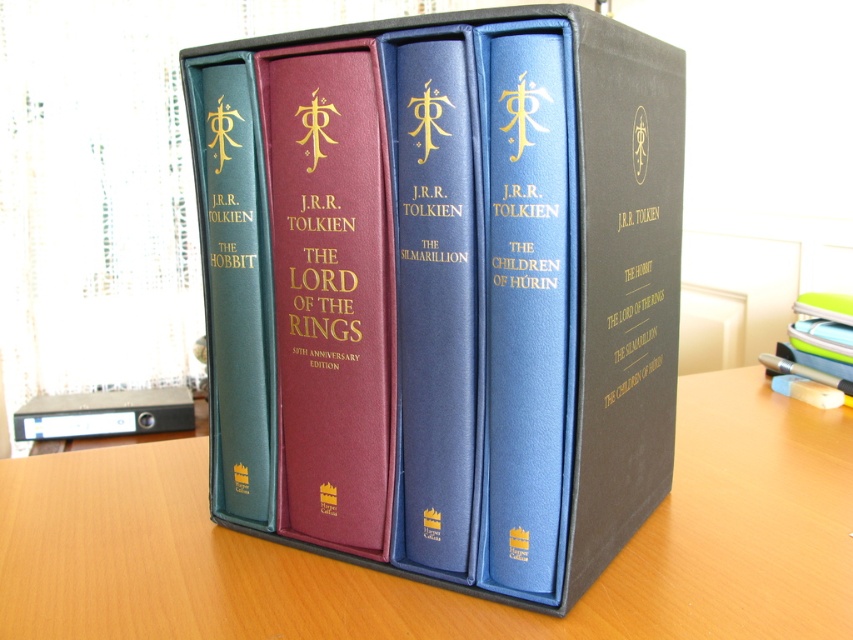
Who is positioned more to the right, wooden table at center or maroon leather book at center?

wooden table at center is more to the right.

Identify the location of wooden table at center. (431, 586).

Is point (405, 580) positioned in front of point (283, 148)?

No, it is behind (283, 148).

The image size is (853, 640). Find the location of `wooden table at center`. wooden table at center is located at coordinates (431, 586).

Between wooden table at center and black leather spine at center, which one is positioned higher?

black leather spine at center

Does wooden table at center have a greater width compared to black leather spine at center?

Indeed, wooden table at center has a greater width compared to black leather spine at center.

The width and height of the screenshot is (853, 640). I want to click on wooden table at center, so click(431, 586).

Between point (376, 230) and point (238, 225), which one is positioned in front?

Positioned in front is point (376, 230).

Who is more distant from viewer, (x=366, y=288) or (x=213, y=228)?

The point (x=213, y=228) is more distant.

The width and height of the screenshot is (853, 640). Identify the location of goldmaterial/texturetitle at center. (329, 285).